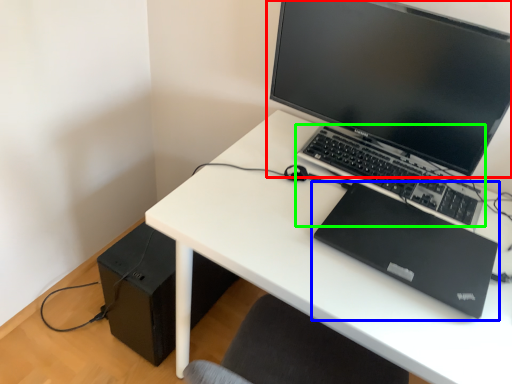
Question: Which is nearer to the computer monitor (highlighted by a red box)? laptop (highlighted by a blue box) or computer keyboard (highlighted by a green box).

Choices:
 (A) laptop
 (B) computer keyboard

Answer: (B)